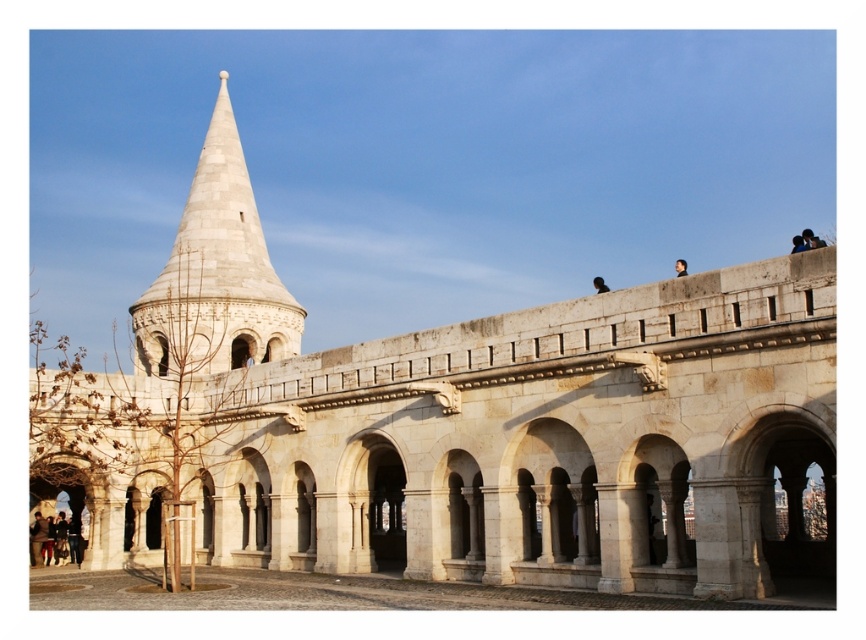
You are standing in front of the historic stone structure and want to determine the relative positions of two points marked on the structure. Which point is closer to you, point (x=208, y=225) or point (x=595, y=285)?

Point (x=208, y=225) is closer to the camera than point (x=595, y=285).